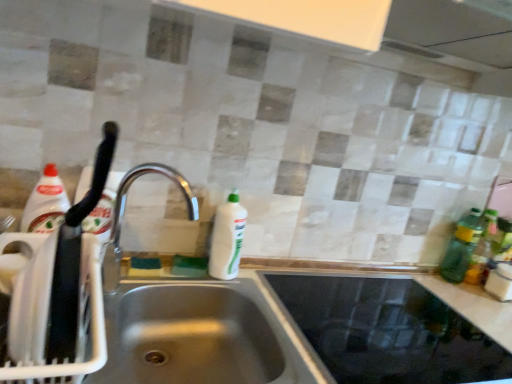
Where is `free location in front of green translucent bottle at right, arranged as the 2th bottle when viewed from the right`? This screenshot has height=384, width=512. free location in front of green translucent bottle at right, arranged as the 2th bottle when viewed from the right is located at coordinates (466, 300).